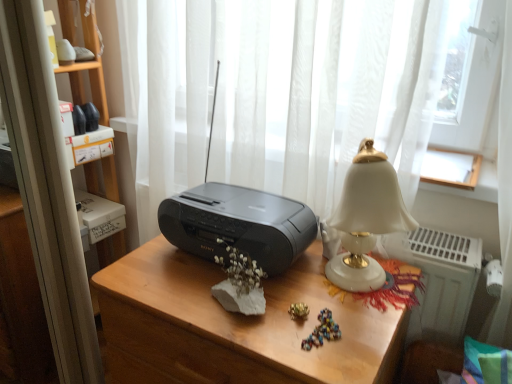
Question: Is point (372, 150) positioned closer to the camera than point (245, 193)?

Choices:
 (A) farther
 (B) closer

Answer: (B)

Question: In terms of size, does white porcelain lamp at right appear bigger or smaller than black plastic printer at center?

Choices:
 (A) big
 (B) small

Answer: (A)

Question: Considering the real-world distances, which object is farthest from the black plastic printer at center?

Choices:
 (A) white sheer curtain at center
 (B) white porcelain lamp at right
 (C) matte black radio at center
 (D) black plastic stereo at center

Answer: (A)

Question: Which object is the closest to the matte black radio at center?

Choices:
 (A) black plastic printer at center
 (B) white porcelain lamp at right
 (C) black plastic stereo at center
 (D) white sheer curtain at center

Answer: (A)